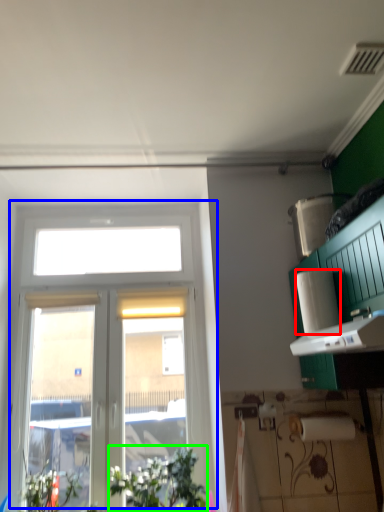
Question: Estimate the real-world distances between objects in this image. Which object is closer to paper towel (highlighted by a red box), window (highlighted by a blue box) or plant (highlighted by a green box)?

Choices:
 (A) window
 (B) plant

Answer: (B)